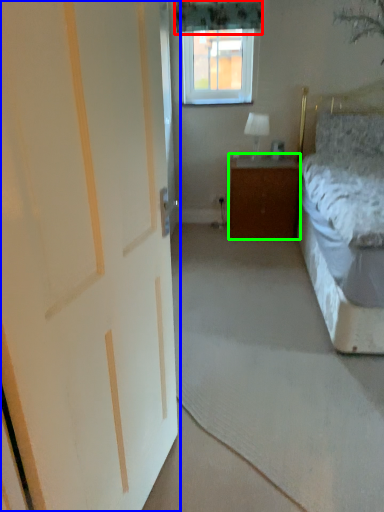
Question: Considering the real-world distances, which object is farthest from curtain (highlighted by a red box)? door (highlighted by a blue box) or cabinetry (highlighted by a green box)?

Choices:
 (A) door
 (B) cabinetry

Answer: (A)